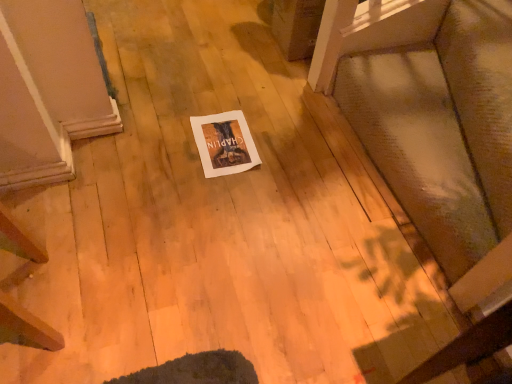
Find the location of a particular element. vacant space to the left of white paper at center is located at coordinates (163, 147).